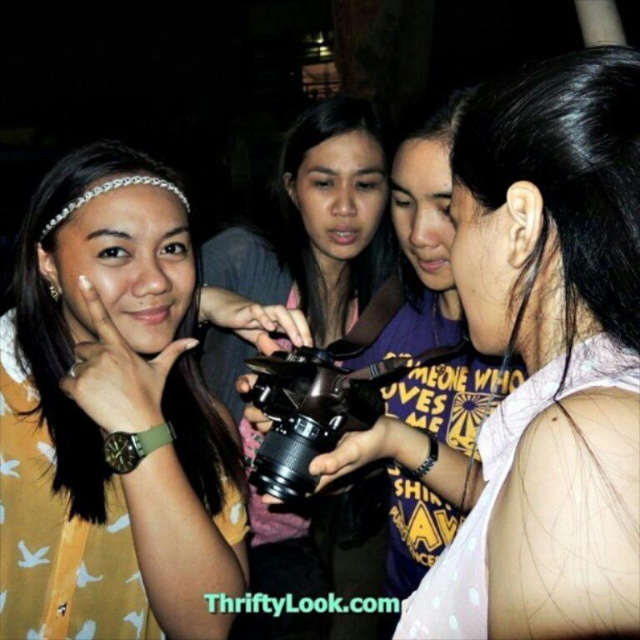
Question: Does pink dotted tank top at center appear over yellow matte shirt at left?

Choices:
 (A) no
 (B) yes

Answer: (B)

Question: Which object is the closest to the black matte camera at center?

Choices:
 (A) black plastic camera at center
 (B) yellow matte shirt at left

Answer: (B)

Question: Considering the relative positions of black matte camera at center and black plastic camera at center in the image provided, where is black matte camera at center located with respect to black plastic camera at center?

Choices:
 (A) above
 (B) below

Answer: (B)

Question: Among these points, which one is farthest from the camera?

Choices:
 (A) (204, 468)
 (B) (624, 186)
 (C) (308, 474)
 (D) (312, 141)

Answer: (D)

Question: Can you confirm if yellow matte shirt at left is wider than black matte camera at center?

Choices:
 (A) no
 (B) yes

Answer: (A)

Question: Which of the following is the closest to the observer?

Choices:
 (A) (317, 221)
 (B) (228, 509)
 (C) (371, 371)

Answer: (C)